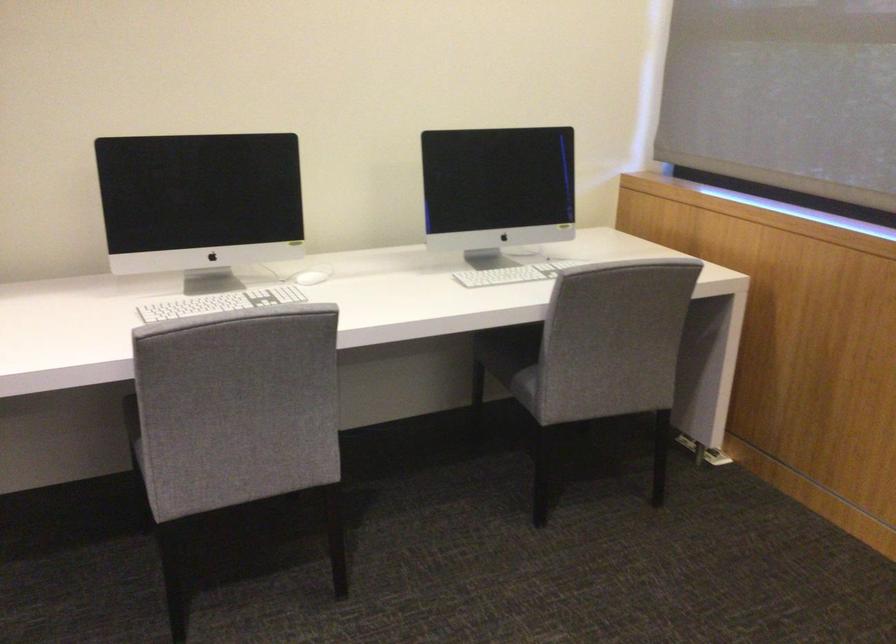
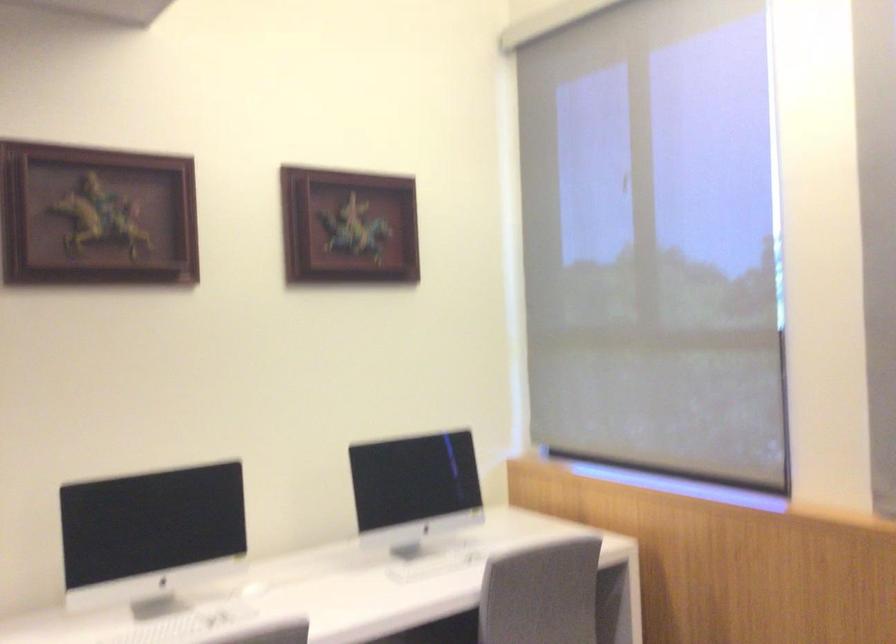
What movement of the cameraman would produce the second image?

The cameraman moved toward left, backward.